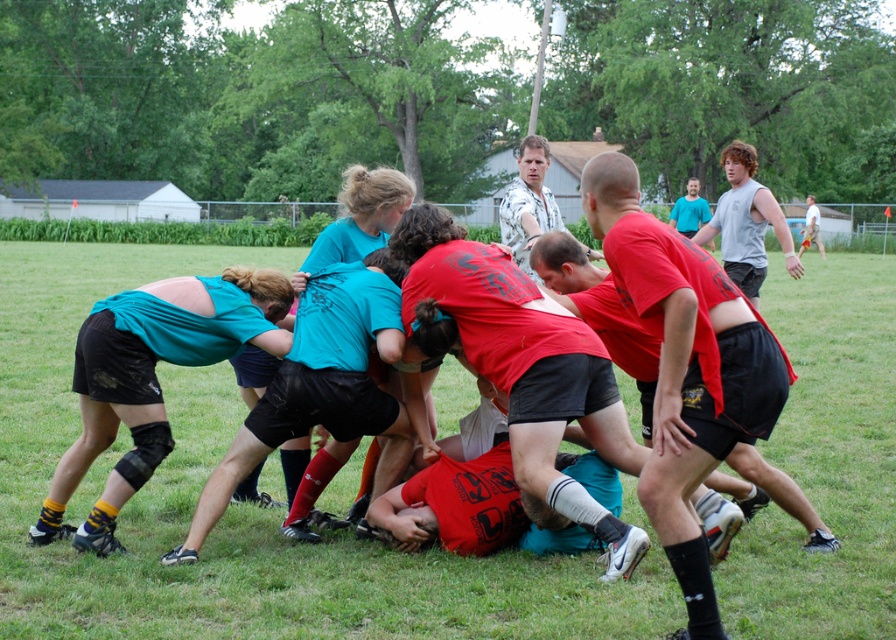
Question: Is green grass at center to the right of matte teal shirt at center from the viewer's perspective?

Choices:
 (A) yes
 (B) no

Answer: (A)

Question: Does green grass at center appear on the left side of matte teal shirt at center?

Choices:
 (A) yes
 (B) no

Answer: (B)

Question: Which object appears closest to the camera in this image?

Choices:
 (A) green grass at center
 (B) matte teal shirt at center

Answer: (A)

Question: Among these objects, which one is farthest from the camera?

Choices:
 (A) green grass at center
 (B) matte teal shirt at center

Answer: (B)

Question: Can you confirm if green grass at center is wider than matte teal shirt at center?

Choices:
 (A) no
 (B) yes

Answer: (B)